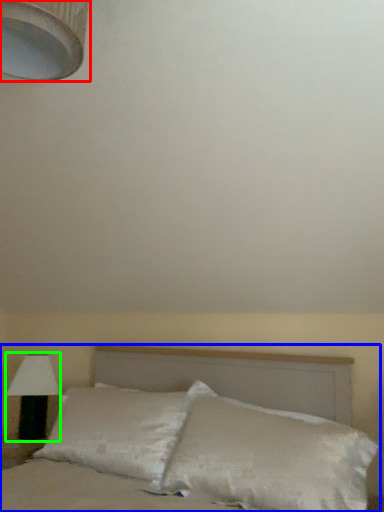
Question: Which object is the farthest from lamp (highlighted by a red box)? Choose among these: bed (highlighted by a blue box) or lamp (highlighted by a green box).

Choices:
 (A) bed
 (B) lamp

Answer: (B)